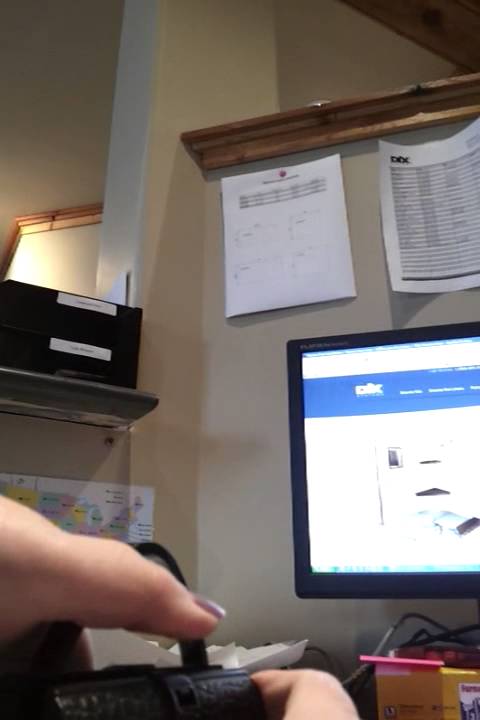
In order to click on ledge in this screenshot , I will do `click(252, 117)`.